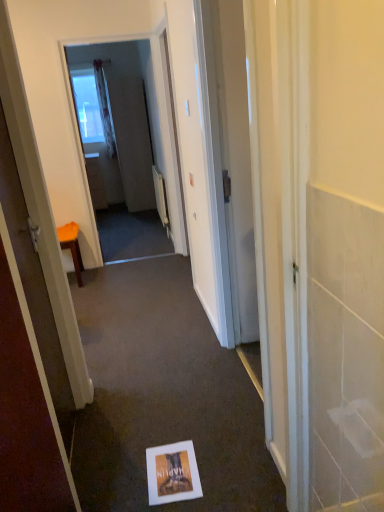
Find the location of a particular element. Image resolution: width=384 pixels, height=512 pixels. empty space that is ontop of matte cardboard postcard at center (from a real-world perspective) is located at coordinates (172, 474).